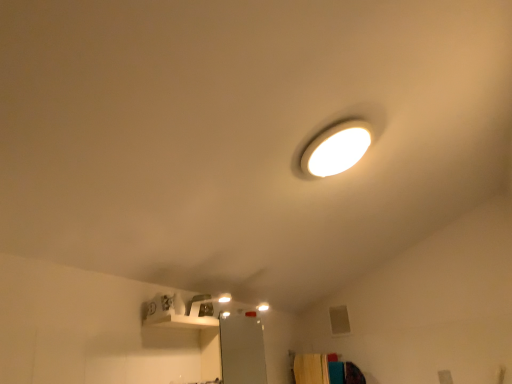
What do you see at coordinates (325, 370) in the screenshot? I see `wooden cabinet at lower right` at bounding box center [325, 370].

Locate an element on the screen. wooden cabinet at lower right is located at coordinates (325, 370).

What do you see at coordinates (205, 304) in the screenshot? I see `white glossy lamp at upper center` at bounding box center [205, 304].

The image size is (512, 384). I want to click on white glossy lamp at upper center, so click(205, 304).

I want to click on wooden cabinet at lower right, so click(x=325, y=370).

Which is more to the right, wooden cabinet at lower right or white glossy lamp at upper center?

wooden cabinet at lower right.

Is wooden cabinet at lower right further to camera compared to white glossy lamp at upper center?

Yes, wooden cabinet at lower right is behind white glossy lamp at upper center.

Is point (325, 363) positioned in front of point (220, 297)?

No, it is not.

From the image's perspective, is wooden cabinet at lower right located above or below white glossy lamp at upper center?

From the image's perspective, wooden cabinet at lower right appears below white glossy lamp at upper center.

From a real-world perspective, is wooden cabinet at lower right physically below white glossy lamp at upper center?

Yes, from a real-world perspective, wooden cabinet at lower right is under white glossy lamp at upper center.

In terms of width, does wooden cabinet at lower right look wider or thinner when compared to white glossy lamp at upper center?

wooden cabinet at lower right is wider than white glossy lamp at upper center.

Can you confirm if wooden cabinet at lower right is shorter than white glossy lamp at upper center?

Incorrect, the height of wooden cabinet at lower right does not fall short of that of white glossy lamp at upper center.

Between wooden cabinet at lower right and white glossy lamp at upper center, which one has larger size?

wooden cabinet at lower right.

Is wooden cabinet at lower right outside of white glossy lamp at upper center?

Yes, wooden cabinet at lower right is not within white glossy lamp at upper center.

Is wooden cabinet at lower right directly adjacent to white glossy lamp at upper center?

There is a gap between wooden cabinet at lower right and white glossy lamp at upper center.

Is wooden cabinet at lower right oriented towards white glossy lamp at upper center?

No, wooden cabinet at lower right is not aimed at white glossy lamp at upper center.

How much distance is there between wooden cabinet at lower right and white glossy lamp at upper center?

wooden cabinet at lower right is 4.78 feet from white glossy lamp at upper center.

The image size is (512, 384). I want to click on furniture below the white glossy lamp at upper center (from the image's perspective), so click(x=325, y=370).

Considering the positions of objects white glossy lamp at upper center and wooden cabinet at lower right in the image provided, who is more to the right, white glossy lamp at upper center or wooden cabinet at lower right?

Positioned to the right is wooden cabinet at lower right.

Is white glossy lamp at upper center in front of wooden cabinet at lower right?

Yes, it is in front of wooden cabinet at lower right.

Does point (226, 302) lie in front of point (333, 374)?

Yes, it is in front of point (333, 374).

From the image's perspective, would you say white glossy lamp at upper center is shown under wooden cabinet at lower right?

Answer: Actually, white glossy lamp at upper center appears above wooden cabinet at lower right in the image.

From a real-world perspective, who is located higher, white glossy lamp at upper center or wooden cabinet at lower right?

white glossy lamp at upper center.

Considering the sizes of objects white glossy lamp at upper center and wooden cabinet at lower right in the image provided, who is thinner, white glossy lamp at upper center or wooden cabinet at lower right?

Thinner between the two is white glossy lamp at upper center.

Considering the sizes of white glossy lamp at upper center and wooden cabinet at lower right in the image, is white glossy lamp at upper center taller or shorter than wooden cabinet at lower right?

Clearly, white glossy lamp at upper center is shorter compared to wooden cabinet at lower right.

Considering the relative sizes of white glossy lamp at upper center and wooden cabinet at lower right in the image provided, is white glossy lamp at upper center smaller than wooden cabinet at lower right?

Yes.

Is white glossy lamp at upper center surrounding wooden cabinet at lower right?

No, wooden cabinet at lower right is not inside white glossy lamp at upper center.

Would you consider white glossy lamp at upper center to be distant from wooden cabinet at lower right?

white glossy lamp at upper center is far away from wooden cabinet at lower right.

Is white glossy lamp at upper center oriented away from wooden cabinet at lower right?

No, wooden cabinet at lower right is not at the back of white glossy lamp at upper center.

How different are the orientations of white glossy lamp at upper center and wooden cabinet at lower right in degrees?

There is a 5.45-degree angle between the facing directions of white glossy lamp at upper center and wooden cabinet at lower right.

How far apart are white glossy lamp at upper center and wooden cabinet at lower right?

white glossy lamp at upper center and wooden cabinet at lower right are 4.78 feet apart from each other.

Identify the location of lamp in front of the wooden cabinet at lower right. Image resolution: width=512 pixels, height=384 pixels. (205, 304).

This screenshot has width=512, height=384. I want to click on lamp located above the wooden cabinet at lower right (from a real-world perspective), so click(205, 304).

Locate an element on the screen. The image size is (512, 384). furniture lying behind the white glossy lamp at upper center is located at coordinates (325, 370).